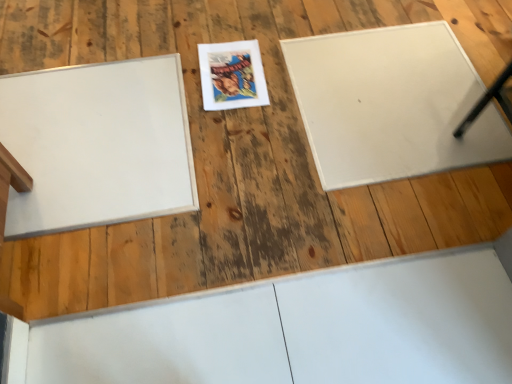
The width and height of the screenshot is (512, 384). I want to click on vacant area situated below white matte board at left, which is the first bulletin board in left-to-right order (from a real-world perspective), so pos(103,139).